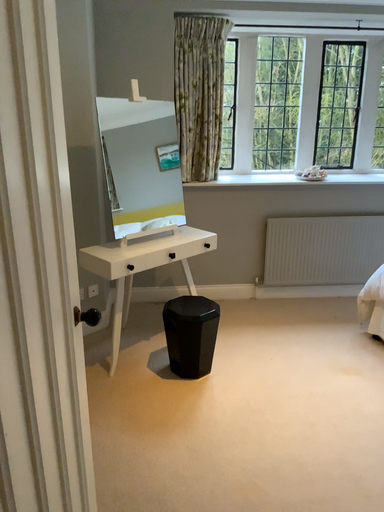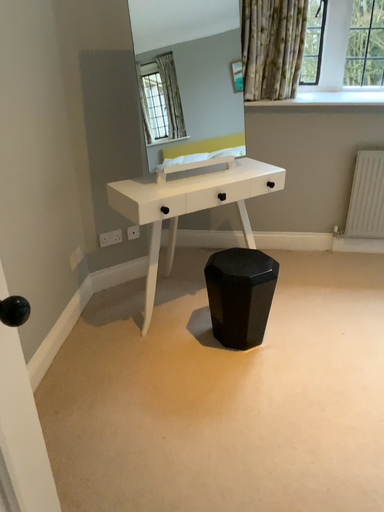
Question: How did the camera likely rotate when shooting the video?

Choices:
 (A) rotated upward
 (B) rotated downward

Answer: (B)